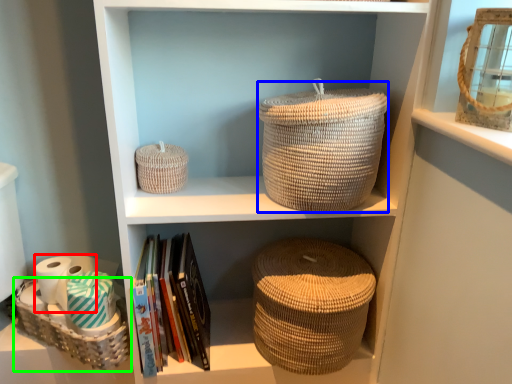
Question: Based on their relative distances, which object is nearer to toilet paper (highlighted by a red box)? Choose from basket (highlighted by a blue box) and basket (highlighted by a green box).

Choices:
 (A) basket
 (B) basket

Answer: (B)